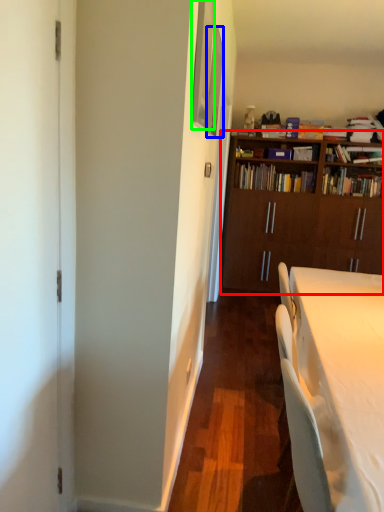
Question: Based on their relative distances, which object is nearer to bookcase (highlighted by a red box)? Choose from picture frame (highlighted by a blue box) and picture frame (highlighted by a green box).

Choices:
 (A) picture frame
 (B) picture frame

Answer: (A)